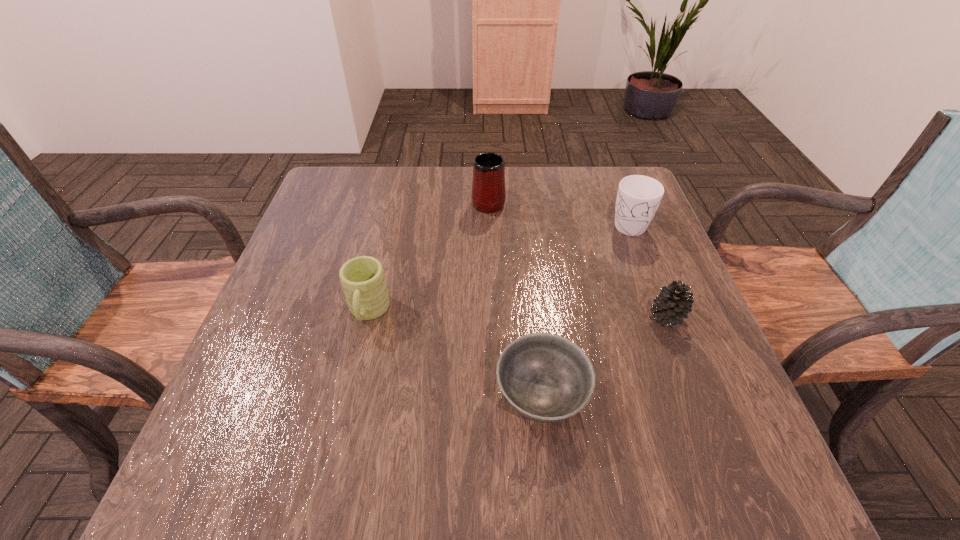
Locate an element on the screen. Image resolution: width=960 pixels, height=540 pixels. blank space located on the side of the shortest mug with the handle is located at coordinates (338, 442).

Image resolution: width=960 pixels, height=540 pixels. In order to click on blank space located on the left of the pinecone in this screenshot , I will do pos(577,316).

What are the coordinates of `free space located 0.090m on the back of the shortest object` in the screenshot? It's located at (533, 322).

Locate an element on the screen. This screenshot has height=540, width=960. mug located in the right edge section of the desktop is located at coordinates (638, 197).

I want to click on pinecone that is positioned at the right edge, so click(x=673, y=304).

Find the location of `object that is at the far right corner`. object that is at the far right corner is located at coordinates (638, 197).

What are the coordinates of `vacant space at the far edge` in the screenshot? It's located at (402, 167).

Identify the location of vacant space at the near edge. The width and height of the screenshot is (960, 540). (636, 474).

Where is `blank space at the left edge`? blank space at the left edge is located at coordinates (348, 235).

In order to click on vacant area at the right edge of the desktop in this screenshot , I will do `click(652, 345)`.